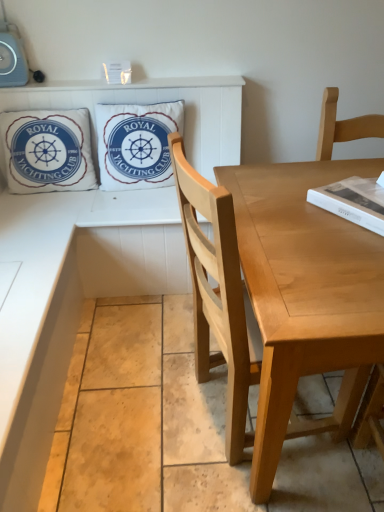
Question: From the image's perspective, relative to white matte book at upper right, is wooden table at lower left above or below?

Choices:
 (A) above
 (B) below

Answer: (B)

Question: From a real-world perspective, is wooden table at lower left positioned above or below white matte book at upper right?

Choices:
 (A) below
 (B) above

Answer: (A)

Question: Estimate the real-world distances between objects in this image. Which object is closer to the wooden table at lower left?

Choices:
 (A) white cotton pillow at upper left, the first pillow from the left
 (B) white cotton pillow at upper center, placed as the 2th pillow when sorted from left to right
 (C) light brown wood chair at right
 (D) white matte book at upper right

Answer: (A)

Question: Considering the real-world distances, which object is closest to the white matte book at upper right?

Choices:
 (A) wooden table at lower left
 (B) light brown wood chair at right
 (C) white cotton pillow at upper left, which is the second pillow in right-to-left order
 (D) white cotton pillow at upper center, placed as the 2th pillow when sorted from left to right

Answer: (B)